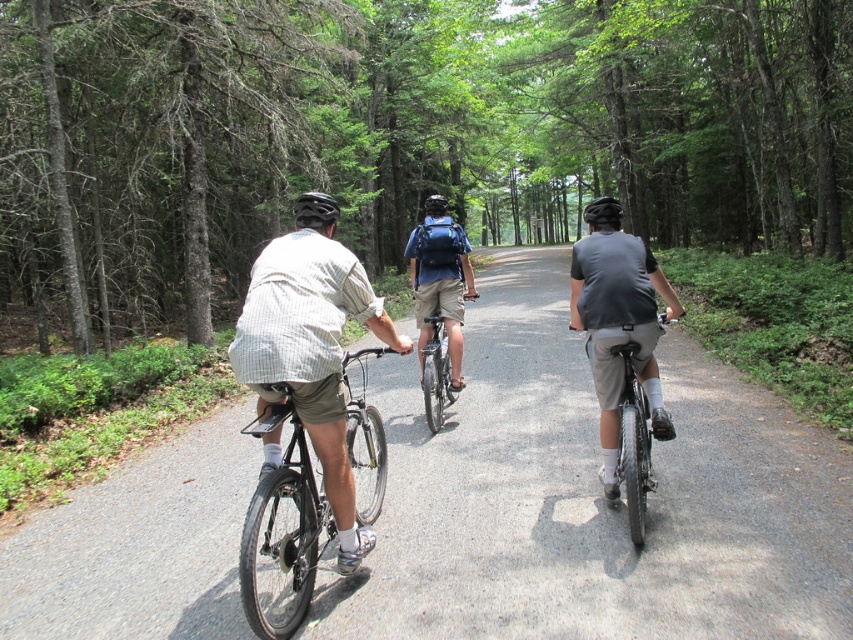
Based on the scene description, where is the light gray plaid shirt at center located in the image?

The light gray plaid shirt at center is located at the 2D coordinates point (311,353) in the image.

You are a cyclist approaching the green matte forest at center and the matte black bicycle at center. Which object is larger in size?

The green matte forest at center is bigger than the matte black bicycle at center.

You are standing at the starting point of the forest path. You see a cyclist wearing a light gray plaid shirt at center. Can you reach them by walking 3 meters towards them?

The light gray plaid shirt at center and viewer are 3.46 meters apart, so walking 3 meters would not reach them since it is shorter than the distance between you and them.